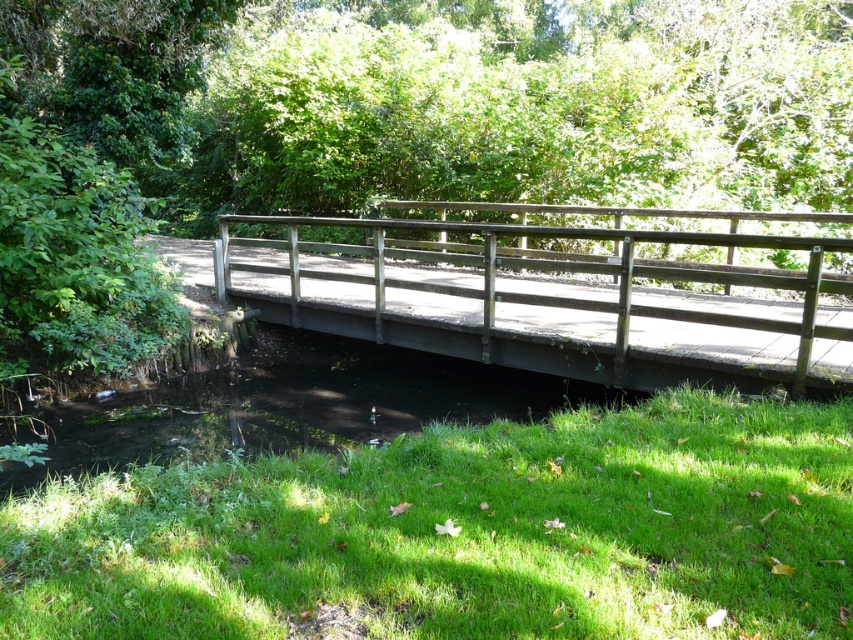
Based on the photo, you are planning to take a photo of the wooden bridge at center and the green leafy tree at center from a position where both are visible. Which object will appear wider in the photo?

The green leafy tree at center will appear wider in the photo because its width surpasses that of the wooden bridge at center.

You are standing on the wooden bridge at center and want to pick a leaf from the green leafy tree at center. Can you reach it without moving from your current position?

The green leafy tree at center is 3.28 meters away from the wooden bridge at center. Since the distance is too far to reach without moving, you cannot pick the leaf while staying in place.

You are a gardener who wants to plant flowers in the green grass at lower center and wooden bridge at center. Which area has more space for planting?

The wooden bridge at center has more space for planting because the green grass at lower center is smaller than the wooden bridge at center.